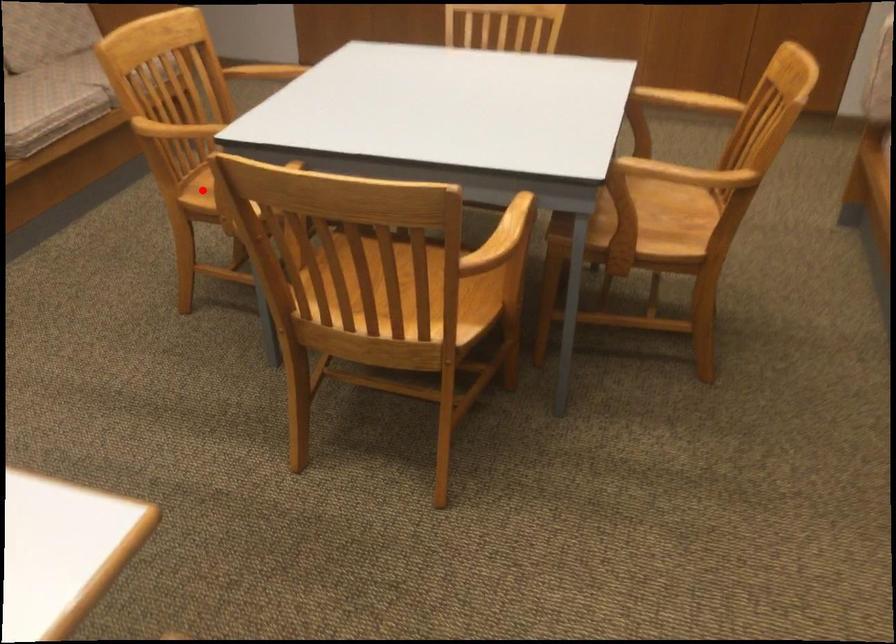
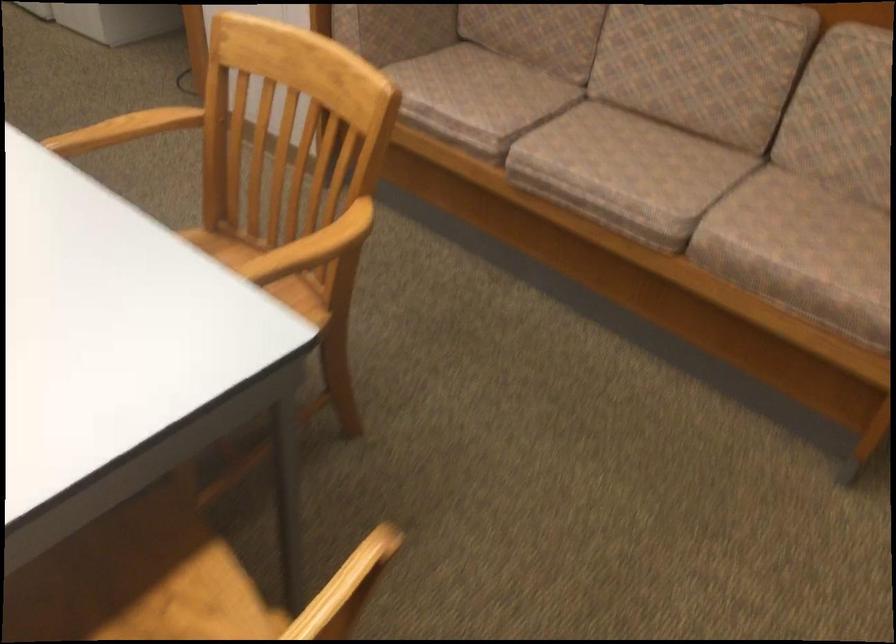
Where in the second image is the point corresponding to the highlighted location from the first image?

(218, 247)